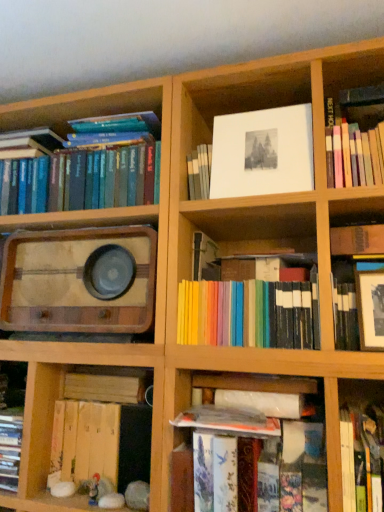
Question: Does matte black frame at upper right, marked as the sixth book in a left-to-right arrangement, appear on the right side of wooden vintage radio at left?

Choices:
 (A) yes
 (B) no

Answer: (A)

Question: Is matte black frame at upper right, marked as the sixth book in a left-to-right arrangement, shorter than wooden vintage radio at left?

Choices:
 (A) no
 (B) yes

Answer: (A)

Question: Considering the relative sizes of matte black frame at upper right, marked as the sixth book in a left-to-right arrangement, and wooden vintage radio at left in the image provided, is matte black frame at upper right, marked as the sixth book in a left-to-right arrangement, wider than wooden vintage radio at left?

Choices:
 (A) no
 (B) yes

Answer: (A)

Question: Is matte black frame at upper right, marked as the sixth book in a left-to-right arrangement, beside wooden vintage radio at left?

Choices:
 (A) yes
 (B) no

Answer: (B)

Question: Is matte black frame at upper right, marked as the second book in a right-to-left arrangement, taller than wooden vintage radio at left?

Choices:
 (A) no
 (B) yes

Answer: (B)

Question: In the image, is pastel rainbow books at center, arranged as the 4th book when viewed from the left, on the left side or the right side of hardcover book at lower right, which is counted as the fifth book, starting from the left?

Choices:
 (A) right
 (B) left

Answer: (B)

Question: Is point (288, 284) positioned closer to the camera than point (349, 508)?

Choices:
 (A) farther
 (B) closer

Answer: (A)

Question: Considering the positions of pastel rainbow books at center, positioned as the 4th book in right-to-left order, and hardcover book at lower right, positioned as the third book in right-to-left order, in the image, is pastel rainbow books at center, positioned as the 4th book in right-to-left order, bigger or smaller than hardcover book at lower right, positioned as the third book in right-to-left order,?

Choices:
 (A) big
 (B) small

Answer: (A)

Question: From the image's perspective, is pastel rainbow books at center, positioned as the 4th book in right-to-left order, located above or below hardcover book at lower right, which is counted as the fifth book, starting from the left?

Choices:
 (A) above
 (B) below

Answer: (A)

Question: From a real-world perspective, relative to wooden book at lower left, which is counted as the fifth book, starting from the right, is hardcover book at upper right, arranged as the 1th book when viewed from the right, vertically above or below?

Choices:
 (A) above
 (B) below

Answer: (A)

Question: From the image's perspective, is hardcover book at upper right, marked as the seventh book in a left-to-right arrangement, positioned above or below wooden book at lower left, which is counted as the fifth book, starting from the right?

Choices:
 (A) above
 (B) below

Answer: (A)

Question: Relative to wooden book at lower left, which is counted as the fifth book, starting from the right, is hardcover book at upper right, arranged as the 1th book when viewed from the right, in front or behind?

Choices:
 (A) front
 (B) behind

Answer: (A)

Question: Would you say hardcover book at upper right, arranged as the 1th book when viewed from the right, is to the left or to the right of wooden book at lower left, placed as the third book when sorted from left to right, in the picture?

Choices:
 (A) right
 (B) left

Answer: (A)

Question: Considering the positions of white paper at upper center and hardcover books at lower center in the image, is white paper at upper center taller or shorter than hardcover books at lower center?

Choices:
 (A) tall
 (B) short

Answer: (A)

Question: In terms of size, does white paper at upper center appear bigger or smaller than hardcover books at lower center?

Choices:
 (A) small
 (B) big

Answer: (A)